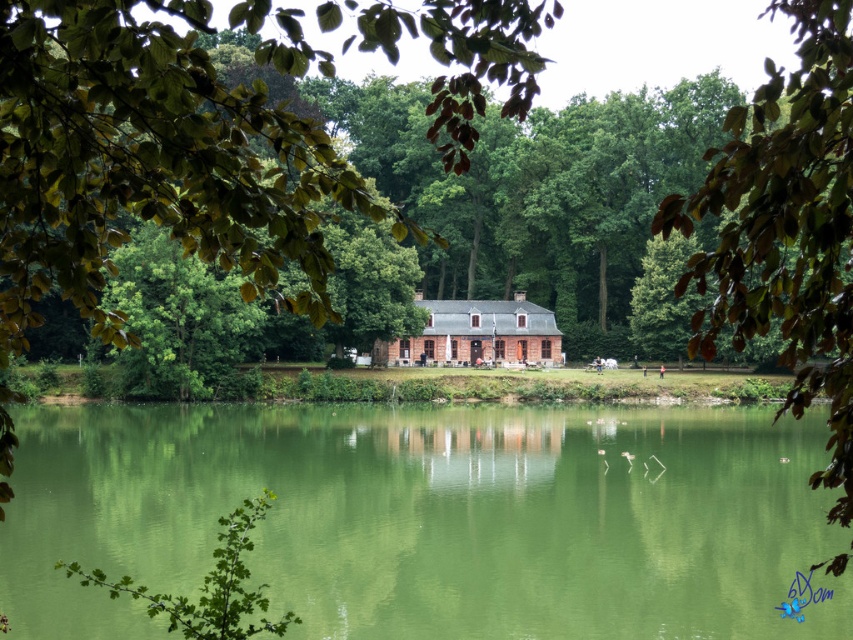
You are planning to install a floating dock on the green smooth water at center near the green leafy tree at upper right. Given that the distance between them is 29.67 meters, will you need a permit if the local regulations require permits for structures over 30 meters from the shoreline?

The distance between the green smooth water at center and the green leafy tree at upper right is 29.67 meters. Since the required permit threshold is 30 meters, the structure is under that distance and therefore does not require a permit.

You are a drone operator trying to capture a photo of the cottage. The drone is currently at the coordinates of the green smooth water at center. To frame the cottage properly, you need to move the drone north by 0.1 units. What will be the new coordinates of the drone after moving north?

A: The green smooth water at center is located at point (430, 518). Moving north by 0.1 units would adjust the y coordinate. Since moving north increases the y value, the new coordinates would be (515, 518).

You are standing at the lakeside and want to take a photo of both the green leafy tree at upper right and the brown brick cottage at center. Which object should you position closer to the edge of the frame to ensure both are fully visible?

Since the green leafy tree at upper right is much taller than the brown brick cottage at center, you should position the taller green leafy tree at upper right closer to the edge of the frame to ensure both are fully visible.